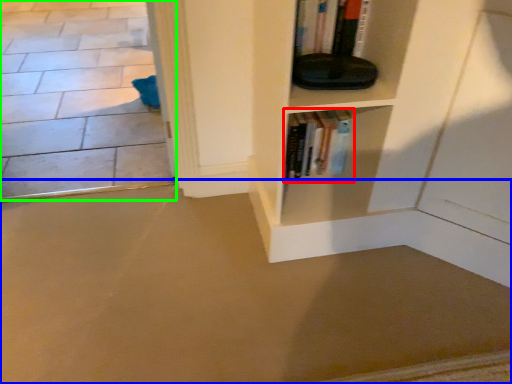
Question: Estimate the real-world distances between objects in this image. Which object is closer to book (highlighted by a red box), concrete (highlighted by a blue box) or concrete (highlighted by a green box)?

Choices:
 (A) concrete
 (B) concrete

Answer: (A)